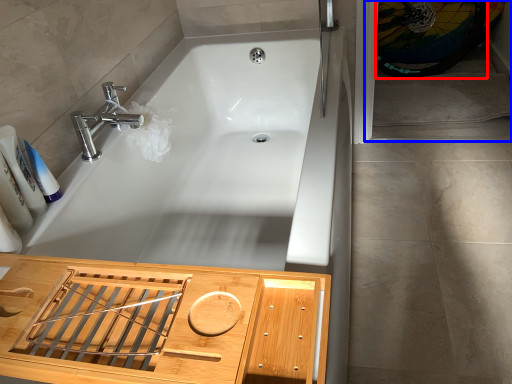
Question: Which object appears closest to the camera in this image, bicycle wheel (highlighted by a red box) or screen door (highlighted by a blue box)?

Choices:
 (A) bicycle wheel
 (B) screen door

Answer: (B)